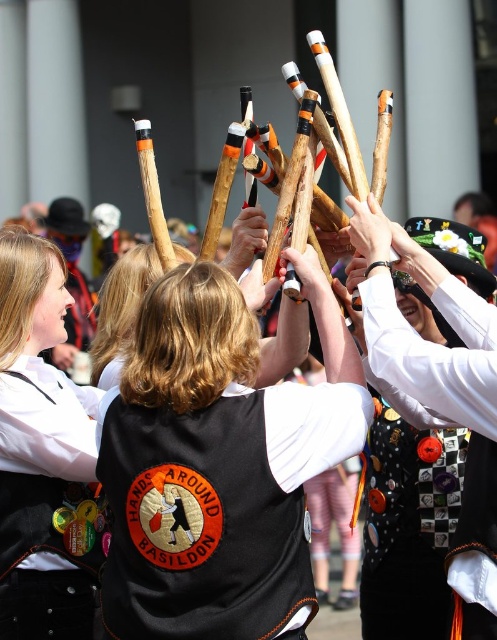
Can you confirm if black fabric vest at center is bigger than matte black vest at center?

Indeed, black fabric vest at center has a larger size compared to matte black vest at center.

How far apart are black fabric vest at center and matte black vest at center?

black fabric vest at center is 5.91 meters from matte black vest at center.

At what (x,y) coordinates should I click in order to perform the action: click on black fabric vest at center. Please return your answer as a coordinate pair (x, y). This screenshot has height=640, width=497. Looking at the image, I should click on (225, 497).